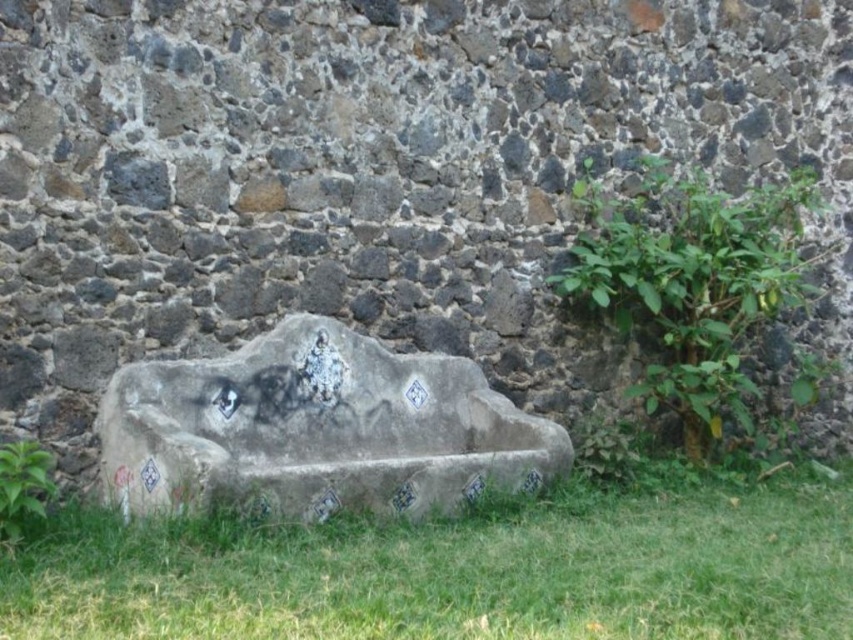
Find the location of a particular element. The height and width of the screenshot is (640, 853). green grass at lower center is located at coordinates tap(462, 570).

Can you confirm if green grass at lower center is positioned above green leafy plant at right?

No, green grass at lower center is not above green leafy plant at right.

The width and height of the screenshot is (853, 640). What do you see at coordinates (462, 570) in the screenshot? I see `green grass at lower center` at bounding box center [462, 570].

Image resolution: width=853 pixels, height=640 pixels. In order to click on green grass at lower center in this screenshot , I will do `click(462, 570)`.

Identify the location of green grass at lower center. (462, 570).

Does green grass at lower center have a smaller size compared to gray concrete bench at center?

Yes, green grass at lower center is smaller than gray concrete bench at center.

What do you see at coordinates (462, 570) in the screenshot? The width and height of the screenshot is (853, 640). I see `green grass at lower center` at bounding box center [462, 570].

Locate an element on the screen. green grass at lower center is located at coordinates (462, 570).

Is the position of green grass at lower center more distant than that of green leafy plant at lower left?

No.

Does green grass at lower center appear under green leafy plant at lower left?

Yes.

Where is `green grass at lower center`? This screenshot has height=640, width=853. green grass at lower center is located at coordinates (462, 570).

Identify the location of green grass at lower center. Image resolution: width=853 pixels, height=640 pixels. (462, 570).